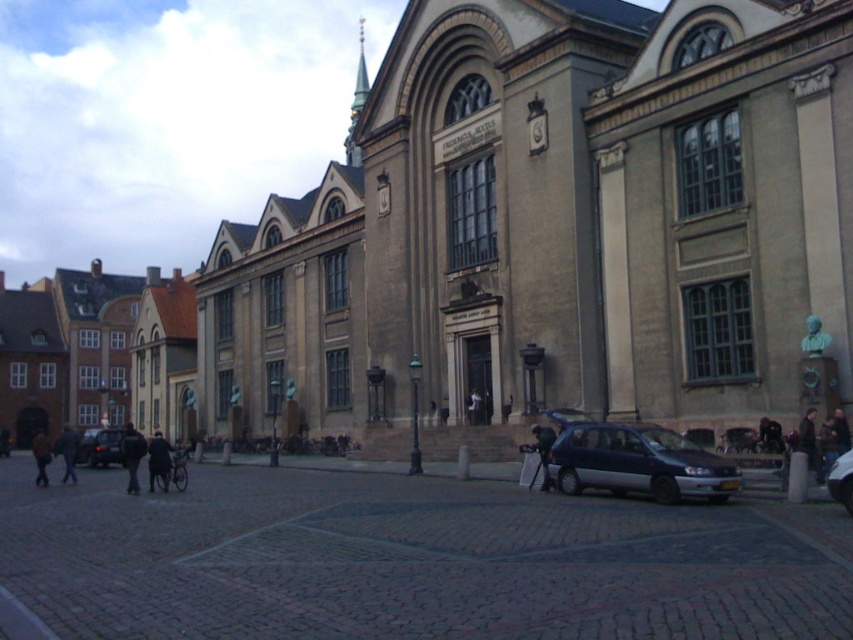
You are a tour guide leading a group to the historic building. You have a car, the satin dark blue hatchback at lower center, and a visitor wearing a dark blue jacket at center. The visitor is standing 32 feet away from the car. If the parking lot has a 30 feet width, can the visitor walk directly from their current position to the car without crossing the parking lot?

The distance between the satin dark blue hatchback at lower center and the dark blue jacket at center is 32.00 feet, which exceeds the parking lot width of 30 feet. Therefore, the visitor would need to walk around the parking lot or use another path to reach the car.

You are standing in the plaza in front of the historic building and see two people wearing jackets. One is wearing a dark blue jacket at lower left and the other a green fabric jacket at center. Which jacket is positioned lower in the image?

The dark blue jacket at lower left is positioned lower in the image than the green fabric jacket at center.

Based on the photo, you are a photographer planning to capture the beige stone church at center and the dark blue jacket at lower left in a single frame. Considering their sizes, which object should you focus on to ensure both are visible without cropping?

The beige stone church at center is wider than the dark blue jacket at lower left. To include both in the frame without cropping, focus on the beige stone church at center as it occupies more space, allowing the dark blue jacket at lower left to fit alongside.